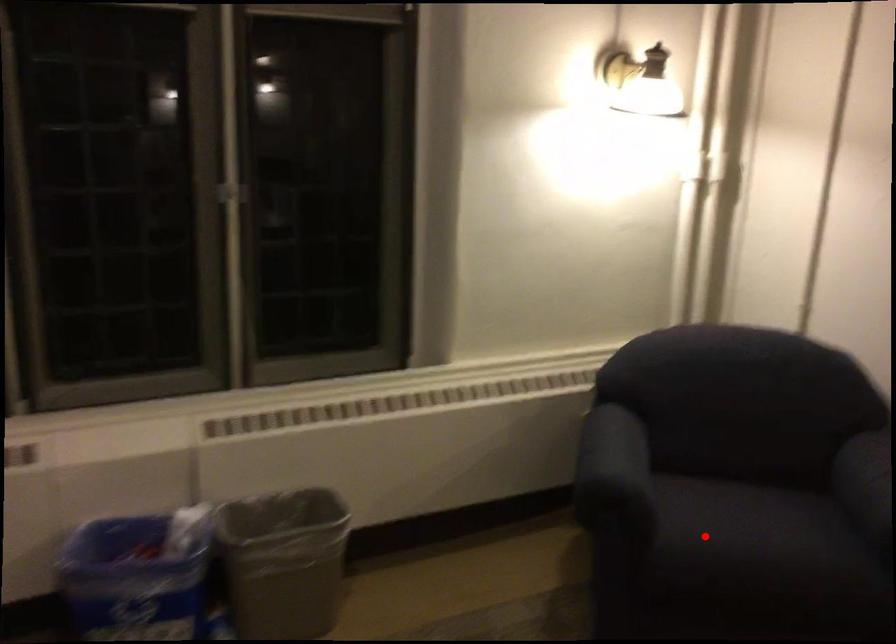
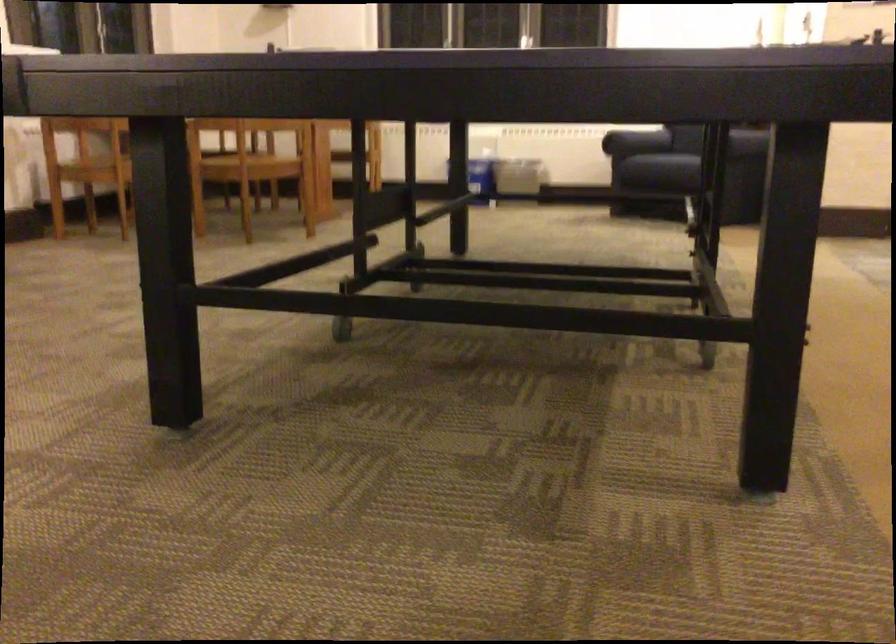
Question: I am providing you with two images of the same scene from different viewpoints. Given a red point in image1, look at the same physical point in image2. Is it:

Choices:
 (A) Closer to the viewpoint
 (B) Farther from the viewpoint

Answer: (B)